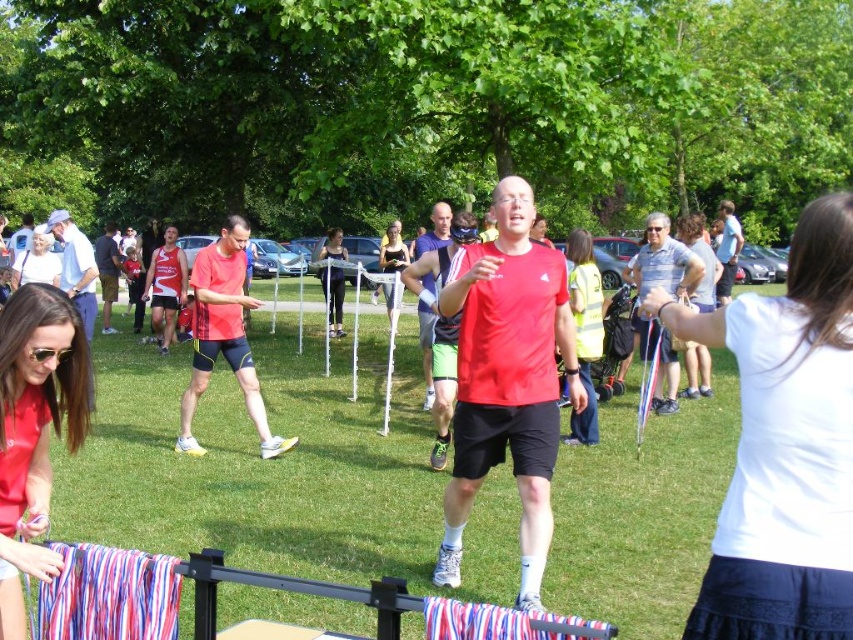
Is matte red shirt at lower left to the right of black mesh tank top at center from the viewer's perspective?

No, matte red shirt at lower left is not to the right of black mesh tank top at center.

Which is above, matte red shirt at lower left or black mesh tank top at center?

Positioned higher is black mesh tank top at center.

At what (x,y) coordinates should I click in order to perform the action: click on matte red shirt at lower left. Please return your answer as a coordinate pair (x, y). Looking at the image, I should click on (36, 413).

Where is `matte red shirt at lower left`? The width and height of the screenshot is (853, 640). matte red shirt at lower left is located at coordinates (36, 413).

Is white cotton shirt at upper right thinner than matte red shirt at lower left?

In fact, white cotton shirt at upper right might be wider than matte red shirt at lower left.

Which is below, white cotton shirt at upper right or matte red shirt at lower left?

matte red shirt at lower left

Does point (706, 314) come closer to viewer compared to point (28, 445)?

Yes, point (706, 314) is closer to viewer.

Locate an element on the screen. white cotton shirt at upper right is located at coordinates click(x=784, y=444).

Which of these two, white cotton shirt at upper right or black mesh tank top at center, stands shorter?

With less height is black mesh tank top at center.

Between point (833, 531) and point (392, 273), which one is positioned in front?

Positioned in front is point (833, 531).

Locate an element on the screen. white cotton shirt at upper right is located at coordinates (784, 444).